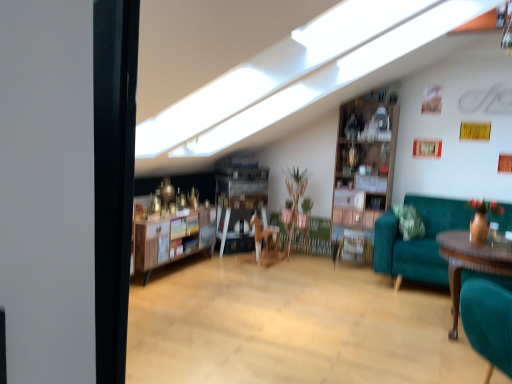
Question: Would you say teal fabric couch at right is inside or outside wooden shelf at center?

Choices:
 (A) inside
 (B) outside

Answer: (B)

Question: Considering the positions of teal fabric couch at right and wooden shelf at center in the image, is teal fabric couch at right wider or thinner than wooden shelf at center?

Choices:
 (A) wide
 (B) thin

Answer: (A)

Question: Considering the real-world distances, which object is closest to the wooden shelf at center?

Choices:
 (A) teal fabric couch at right
 (B) wooden polished table at right

Answer: (A)

Question: Estimate the real-world distances between objects in this image. Which object is closer to the teal fabric couch at right?

Choices:
 (A) wooden shelf at center
 (B) wooden polished table at right

Answer: (B)